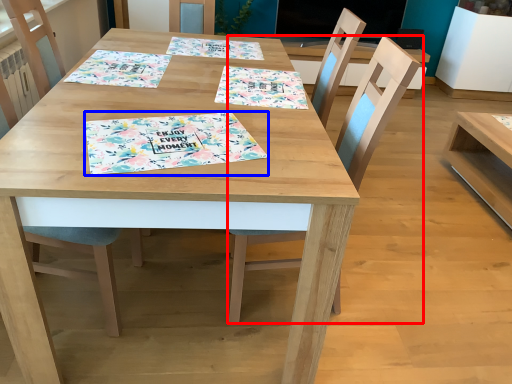
Question: Which point is closer to the camera, chair (highlighted by a red box) or place mat (highlighted by a blue box)?

Choices:
 (A) chair
 (B) place mat

Answer: (B)